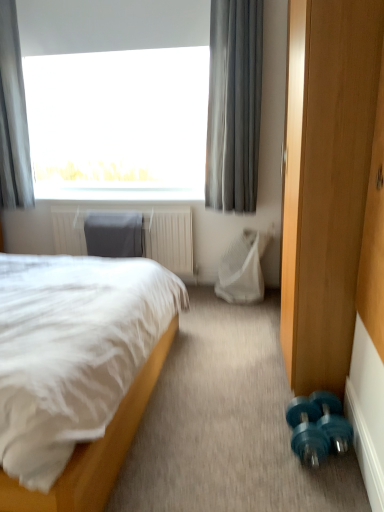
The image size is (384, 512). Describe the element at coordinates (13, 117) in the screenshot. I see `gray fabric curtain at upper left, which is the 2th curtain in right-to-left order` at that location.

In order to face gray fabric curtain at upper left, the first curtain viewed from the left, should I rotate leftwards or rightwards?

Rotate your view left by about 24.499°.

This screenshot has height=512, width=384. I want to click on teal plastic dumbbells at lower right, so click(326, 182).

The height and width of the screenshot is (512, 384). What do you see at coordinates (74, 366) in the screenshot?
I see `white soft bed at left` at bounding box center [74, 366].

Measure the distance between point (128, 284) and camera.

Point (128, 284) is 6.80 feet away from camera.

I want to click on teal rubber dumbbell at lower right, so click(x=318, y=426).

The height and width of the screenshot is (512, 384). Find the location of `gray sheer curtain at upper center, acting as the 2th curtain starting from the left`. gray sheer curtain at upper center, acting as the 2th curtain starting from the left is located at coordinates (234, 105).

At what (x,y) coordinates should I click in order to perform the action: click on curtain lying in front of the gray fabric curtain at upper left, which is the 2th curtain in right-to-left order. Please return your answer as a coordinate pair (x, y). Looking at the image, I should click on [x=234, y=105].

Is gray fabric curtain at upper left, the first curtain viewed from the left, positioned with its back to gray sheer curtain at upper center, which is the 1th curtain in right-to-left order?

No, gray fabric curtain at upper left, the first curtain viewed from the left, is not facing away from gray sheer curtain at upper center, which is the 1th curtain in right-to-left order.

Are gray fabric curtain at upper left, which is the 2th curtain in right-to-left order, and gray sheer curtain at upper center, which is the 1th curtain in right-to-left order, located far from each other?

Yes, gray fabric curtain at upper left, which is the 2th curtain in right-to-left order, is far from gray sheer curtain at upper center, which is the 1th curtain in right-to-left order.

Choose the correct answer: Is gray fabric curtain at upper left, which is the 2th curtain in right-to-left order, inside gray sheer curtain at upper center, acting as the 2th curtain starting from the left, or outside it?

gray fabric curtain at upper left, which is the 2th curtain in right-to-left order, exists outside the volume of gray sheer curtain at upper center, acting as the 2th curtain starting from the left.

Would you say white soft bed at left is inside or outside teal rubber dumbbell at lower right?

The correct answer is: outside.

In terms of width, does white soft bed at left look wider or thinner when compared to teal rubber dumbbell at lower right?

Clearly, white soft bed at left has more width compared to teal rubber dumbbell at lower right.

Would you consider white soft bed at left to be distant from teal rubber dumbbell at lower right?

No, white soft bed at left is not far away from teal rubber dumbbell at lower right.

The image size is (384, 512). I want to click on dumbbell beneath the white soft bed at left (from a real-world perspective), so click(x=318, y=426).

Is dark gray fabric swivel chair at center, the first swivel chair when ordered from left to right, at the left side of gray fabric curtain at upper left, which is the 2th curtain in right-to-left order?

No, dark gray fabric swivel chair at center, the first swivel chair when ordered from left to right, is not to the left of gray fabric curtain at upper left, which is the 2th curtain in right-to-left order.

From the image's perspective, who appears lower, dark gray fabric swivel chair at center, the first swivel chair when ordered from left to right, or gray fabric curtain at upper left, which is the 2th curtain in right-to-left order?

dark gray fabric swivel chair at center, the first swivel chair when ordered from left to right, from the image's perspective.

Is dark gray fabric swivel chair at center, the first swivel chair when ordered from left to right, spatially inside gray fabric curtain at upper left, which is the 2th curtain in right-to-left order, or outside of it?

dark gray fabric swivel chair at center, the first swivel chair when ordered from left to right, is spatially situated outside gray fabric curtain at upper left, which is the 2th curtain in right-to-left order.

Are dark gray fabric swivel chair at center, acting as the second swivel chair starting from the right, and gray fabric curtain at upper left, which is the 2th curtain in right-to-left order, far apart?

No, dark gray fabric swivel chair at center, acting as the second swivel chair starting from the right, is not far away from gray fabric curtain at upper left, which is the 2th curtain in right-to-left order.

Is white mesh swivel chair at center, which is the second swivel chair in left-to-right order, at the back of gray sheer curtain at upper center, which is the 1th curtain in right-to-left order?

No, white mesh swivel chair at center, which is the second swivel chair in left-to-right order, is not at the back of gray sheer curtain at upper center, which is the 1th curtain in right-to-left order.

Is point (256, 16) farther from viewer compared to point (227, 294)?

That is False.

From a real-world perspective, is gray sheer curtain at upper center, which is the 1th curtain in right-to-left order, physically above white mesh swivel chair at center, the first swivel chair when ordered from right to left?

Yes, from a real-world perspective, gray sheer curtain at upper center, which is the 1th curtain in right-to-left order, is over white mesh swivel chair at center, the first swivel chair when ordered from right to left

From the picture: Which point is more distant from viewer, (239, 278) or (313, 276)?

The point (239, 278) is behind.

Locate an element on the screen. screen door located in front of the white mesh swivel chair at center, the first swivel chair when ordered from right to left is located at coordinates (326, 182).

Based on the photo, does white mesh swivel chair at center, which is the second swivel chair in left-to-right order, have a larger size compared to teal plastic dumbbells at lower right?

No.

Which of these two, white mesh swivel chair at center, which is the second swivel chair in left-to-right order, or teal plastic dumbbells at lower right, stands taller?

With more height is teal plastic dumbbells at lower right.

From their relative heights in the image, would you say dark gray fabric swivel chair at center, acting as the second swivel chair starting from the right, is taller or shorter than teal rubber dumbbell at lower right?

dark gray fabric swivel chair at center, acting as the second swivel chair starting from the right, is taller than teal rubber dumbbell at lower right.

How far apart are dark gray fabric swivel chair at center, the first swivel chair when ordered from left to right, and teal rubber dumbbell at lower right?

The distance of dark gray fabric swivel chair at center, the first swivel chair when ordered from left to right, from teal rubber dumbbell at lower right is 1.97 meters.

Looking at this image, considering the positions of objects dark gray fabric swivel chair at center, the first swivel chair when ordered from left to right, and teal rubber dumbbell at lower right in the image provided, who is more to the right, dark gray fabric swivel chair at center, the first swivel chair when ordered from left to right, or teal rubber dumbbell at lower right?

teal rubber dumbbell at lower right.

How many degrees apart are the facing directions of teal plastic dumbbells at lower right and white mesh swivel chair at center, the first swivel chair when ordered from right to left?

The facing directions of teal plastic dumbbells at lower right and white mesh swivel chair at center, the first swivel chair when ordered from right to left, are 94.4 degrees apart.

Between point (329, 359) and point (268, 234), which one is positioned in front?

The point (329, 359) is closer to the camera.

In terms of width, does teal plastic dumbbells at lower right look wider or thinner when compared to white mesh swivel chair at center, the first swivel chair when ordered from right to left?

teal plastic dumbbells at lower right is wider than white mesh swivel chair at center, the first swivel chair when ordered from right to left.

Is teal plastic dumbbells at lower right beside white mesh swivel chair at center, which is the second swivel chair in left-to-right order?

There is a gap between teal plastic dumbbells at lower right and white mesh swivel chair at center, which is the second swivel chair in left-to-right order.

The height and width of the screenshot is (512, 384). In order to click on curtain to the left of gray sheer curtain at upper center, which is the 1th curtain in right-to-left order in this screenshot , I will do `click(13, 117)`.

This screenshot has height=512, width=384. I want to click on bed above the teal rubber dumbbell at lower right (from a real-world perspective), so click(74, 366).

Considering their positions, is gray fabric curtain at upper left, the first curtain viewed from the left, positioned closer to teal rubber dumbbell at lower right than dark gray fabric swivel chair at center, the first swivel chair when ordered from left to right?

Among the two, dark gray fabric swivel chair at center, the first swivel chair when ordered from left to right, is located nearer to teal rubber dumbbell at lower right.

Based on their spatial positions, is gray fabric curtain at upper left, the first curtain viewed from the left, or dark gray fabric swivel chair at center, the first swivel chair when ordered from left to right, further from white soft bed at left?

Among the two, gray fabric curtain at upper left, the first curtain viewed from the left, is located further to white soft bed at left.

In the scene shown: Which object lies nearer to the anchor point white soft bed at left, teal rubber dumbbell at lower right or teal plastic dumbbells at lower right?

teal rubber dumbbell at lower right lies closer to white soft bed at left than the other object.

Looking at the image, which one is located further to gray fabric curtain at upper left, which is the 2th curtain in right-to-left order, gray sheer curtain at upper center, acting as the 2th curtain starting from the left, or teal plastic dumbbells at lower right?

The object further to gray fabric curtain at upper left, which is the 2th curtain in right-to-left order, is teal plastic dumbbells at lower right.

Looking at the image, which one is located further to dark gray fabric swivel chair at center, the first swivel chair when ordered from left to right, gray fabric curtain at upper left, which is the 2th curtain in right-to-left order, or white soft bed at left?

Among the two, white soft bed at left is located further to dark gray fabric swivel chair at center, the first swivel chair when ordered from left to right.

From the image, which object appears to be farther from teal rubber dumbbell at lower right, gray sheer curtain at upper center, which is the 1th curtain in right-to-left order, or white mesh swivel chair at center, the first swivel chair when ordered from right to left?

gray sheer curtain at upper center, which is the 1th curtain in right-to-left order, lies further to teal rubber dumbbell at lower right than the other object.

Looking at the image, which one is located further to dark gray fabric swivel chair at center, acting as the second swivel chair starting from the right, teal plastic dumbbells at lower right or teal rubber dumbbell at lower right?

teal rubber dumbbell at lower right is positioned further to the anchor dark gray fabric swivel chair at center, acting as the second swivel chair starting from the right.

Based on their spatial positions, is gray fabric curtain at upper left, which is the 2th curtain in right-to-left order, or dark gray fabric swivel chair at center, acting as the second swivel chair starting from the right, closer to teal plastic dumbbells at lower right?

dark gray fabric swivel chair at center, acting as the second swivel chair starting from the right, is closer to teal plastic dumbbells at lower right.

Where is `dumbbell located between teal plastic dumbbells at lower right and white mesh swivel chair at center, the first swivel chair when ordered from right to left, in the depth direction`? dumbbell located between teal plastic dumbbells at lower right and white mesh swivel chair at center, the first swivel chair when ordered from right to left, in the depth direction is located at coordinates (318, 426).

This screenshot has width=384, height=512. What are the coordinates of `curtain between gray fabric curtain at upper left, which is the 2th curtain in right-to-left order, and teal plastic dumbbells at lower right from left to right` in the screenshot? It's located at (234, 105).

Where is `screen door between white soft bed at left and gray sheer curtain at upper center, which is the 1th curtain in right-to-left order, along the z-axis`? The image size is (384, 512). screen door between white soft bed at left and gray sheer curtain at upper center, which is the 1th curtain in right-to-left order, along the z-axis is located at coordinates (326, 182).

Image resolution: width=384 pixels, height=512 pixels. Identify the location of bed between gray fabric curtain at upper left, which is the 2th curtain in right-to-left order, and teal rubber dumbbell at lower right from left to right. pyautogui.click(x=74, y=366).